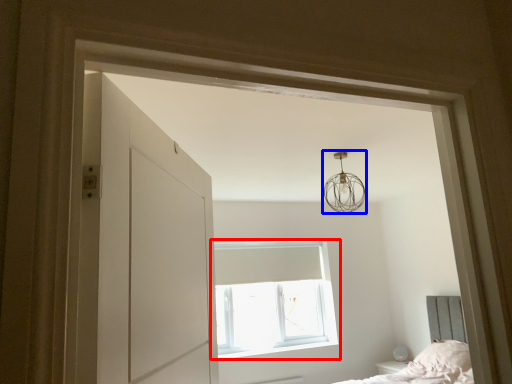
Question: Which object is closer to the camera taking this photo, window (highlighted by a red box) or lamp (highlighted by a blue box)?

Choices:
 (A) window
 (B) lamp

Answer: (B)